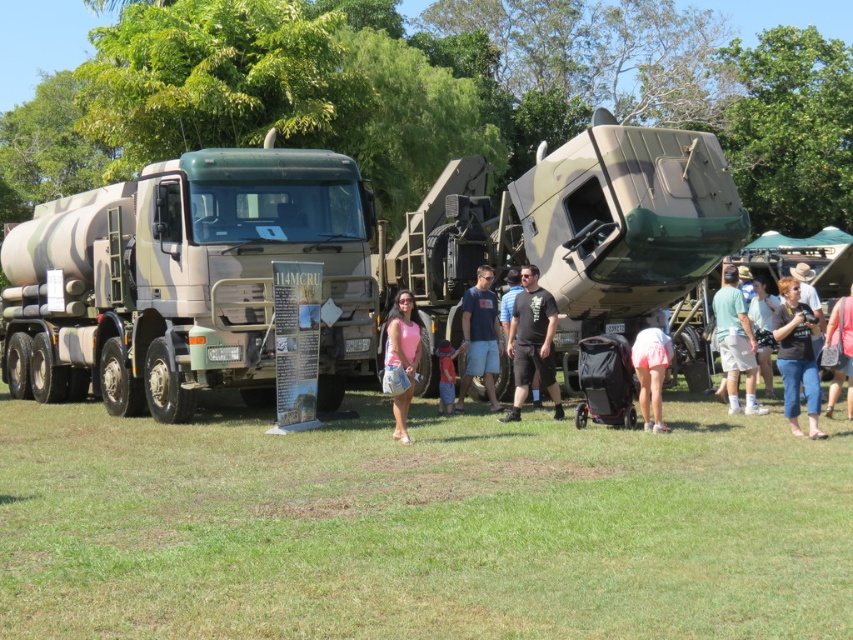
Is camouflage fabric missile launcher at center wider than pink fabric shorts at lower right?

No.

Can you confirm if camouflage fabric missile launcher at center is thinner than pink fabric shorts at lower right?

Yes.

Where is `camouflage fabric missile launcher at center`? camouflage fabric missile launcher at center is located at coordinates (578, 227).

Between point (735, 268) and point (442, 340), which one is positioned in front?

Point (442, 340) is more forward.

This screenshot has width=853, height=640. What do you see at coordinates (735, 342) in the screenshot? I see `green cotton shirt at right` at bounding box center [735, 342].

Between point (735, 356) and point (448, 376), which one is positioned in front?

Positioned in front is point (735, 356).

The image size is (853, 640). I want to click on green cotton shirt at right, so click(x=735, y=342).

Is point (424, 401) farther from camera compared to point (402, 392)?

That is True.

Does green grass at center have a smaller size compared to pink fabric dress at center?

Incorrect, green grass at center is not smaller in size than pink fabric dress at center.

Image resolution: width=853 pixels, height=640 pixels. What do you see at coordinates (421, 525) in the screenshot? I see `green grass at center` at bounding box center [421, 525].

Where is `green grass at center`? Image resolution: width=853 pixels, height=640 pixels. green grass at center is located at coordinates (421, 525).